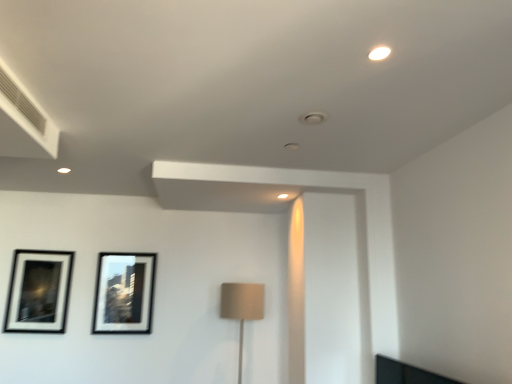
Question: Does matte black picture frame at center left, positioned as the first picture frame in right-to-left order, lie behind black matte picture frame at upper left, which is the second picture frame from right to left?

Choices:
 (A) no
 (B) yes

Answer: (B)

Question: Is matte black picture frame at center left, positioned as the first picture frame in right-to-left order, facing away from black matte picture frame at upper left, which is the second picture frame from right to left?

Choices:
 (A) yes
 (B) no

Answer: (B)

Question: From a real-world perspective, does matte black picture frame at center left, positioned as the first picture frame in right-to-left order, sit lower than black matte picture frame at upper left, positioned as the 1th picture frame in left-to-right order?

Choices:
 (A) no
 (B) yes

Answer: (A)

Question: Is the surface of matte black picture frame at center left, acting as the second picture frame starting from the left, in direct contact with black matte picture frame at upper left, which is the second picture frame from right to left?

Choices:
 (A) yes
 (B) no

Answer: (B)

Question: Is matte black picture frame at center left, positioned as the first picture frame in right-to-left order, at the left side of black matte picture frame at upper left, which is the second picture frame from right to left?

Choices:
 (A) yes
 (B) no

Answer: (B)

Question: Is matte black picture frame at center left, positioned as the first picture frame in right-to-left order, not close to black matte picture frame at upper left, positioned as the 1th picture frame in left-to-right order?

Choices:
 (A) no
 (B) yes

Answer: (A)

Question: Can you confirm if beige fabric lampshade at center is taller than black matte picture frame at upper left, positioned as the 1th picture frame in left-to-right order?

Choices:
 (A) no
 (B) yes

Answer: (B)

Question: Would you say beige fabric lampshade at center is outside black matte picture frame at upper left, which is the second picture frame from right to left?

Choices:
 (A) yes
 (B) no

Answer: (A)

Question: From a real-world perspective, is beige fabric lampshade at center below black matte picture frame at upper left, positioned as the 1th picture frame in left-to-right order?

Choices:
 (A) yes
 (B) no

Answer: (A)

Question: Is beige fabric lampshade at center positioned far away from black matte picture frame at upper left, which is the second picture frame from right to left?

Choices:
 (A) no
 (B) yes

Answer: (B)

Question: From a real-world perspective, is beige fabric lampshade at center over black matte picture frame at upper left, which is the second picture frame from right to left?

Choices:
 (A) yes
 (B) no

Answer: (B)

Question: Is black matte picture frame at upper left, which is the second picture frame from right to left, inside beige fabric lampshade at center?

Choices:
 (A) no
 (B) yes

Answer: (A)

Question: Are black matte picture frame at upper left, positioned as the 1th picture frame in left-to-right order, and matte black picture frame at center left, acting as the second picture frame starting from the left, located far from each other?

Choices:
 (A) yes
 (B) no

Answer: (B)